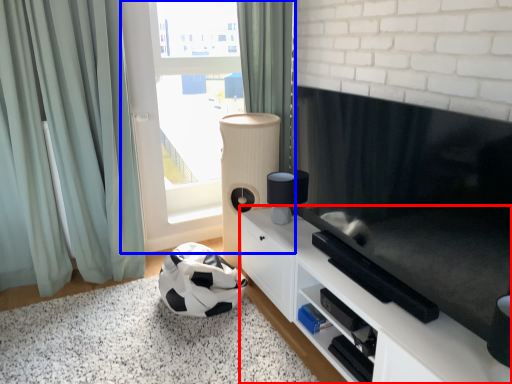
Question: Which object is closer to the camera taking this photo, cabinetry (highlighted by a red box) or window (highlighted by a blue box)?

Choices:
 (A) cabinetry
 (B) window

Answer: (A)